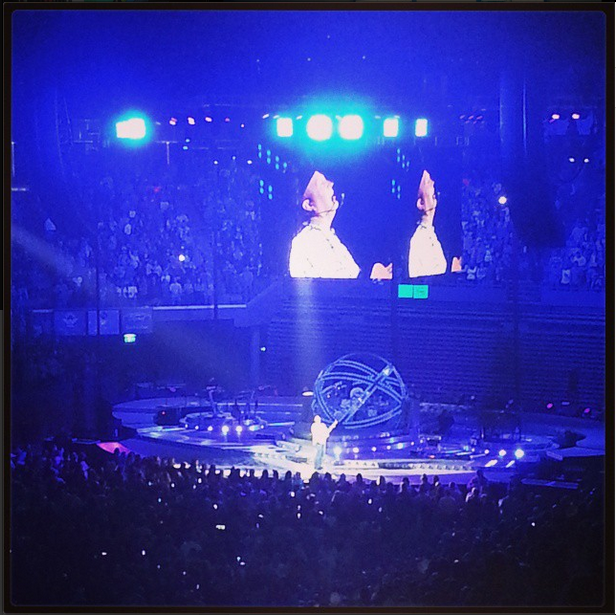
Locate an element on the screen. Image resolution: width=616 pixels, height=615 pixels. lights is located at coordinates (363, 129).